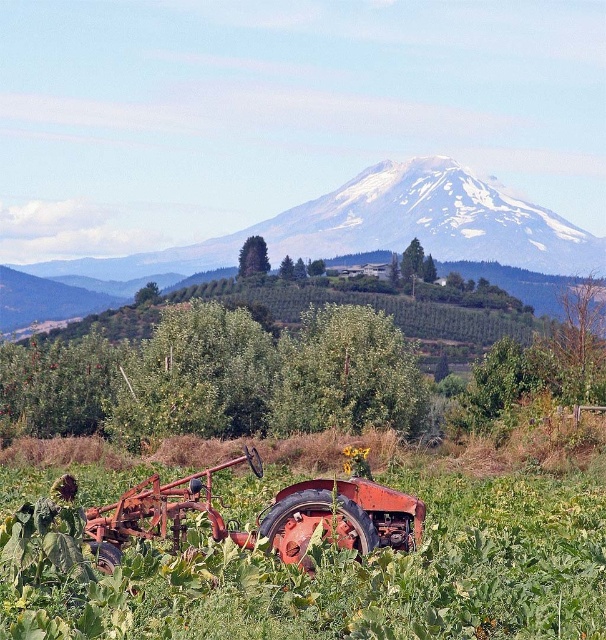
Does green leafy grass at center appear on the right side of rusty metal tractor at lower center?

No, green leafy grass at center is not to the right of rusty metal tractor at lower center.

Is green leafy grass at center further to camera compared to rusty metal tractor at lower center?

No, it is not.

What do you see at coordinates (405, 576) in the screenshot?
I see `green leafy grass at center` at bounding box center [405, 576].

The height and width of the screenshot is (640, 606). Find the location of `green leafy grass at center`. green leafy grass at center is located at coordinates (405, 576).